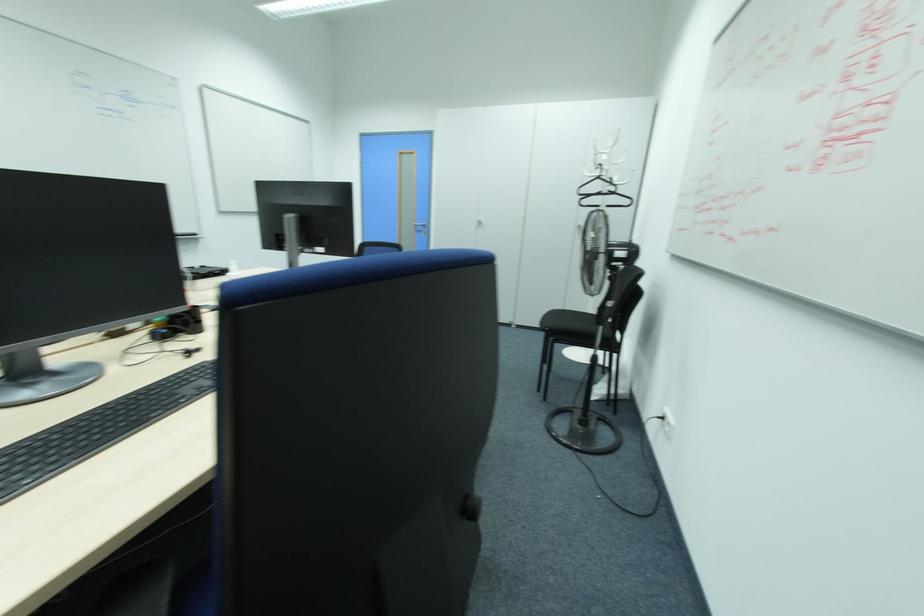
At what (x,y) coordinates should I click in order to perform the action: click on chair sitting surface. Please return your answer as a coordinate pair (x, y). The image size is (924, 616). Looking at the image, I should click on (569, 322).